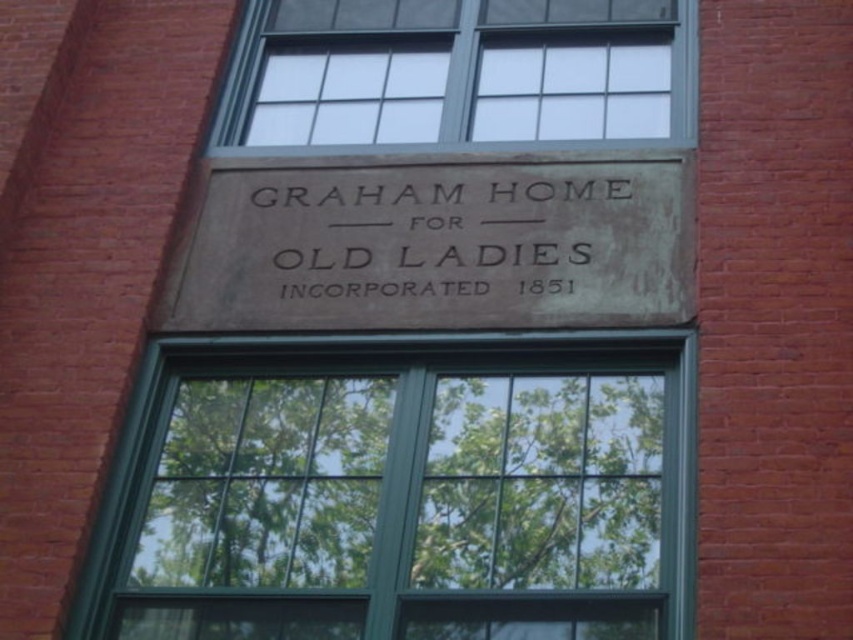
Question: Which of the following is the farthest from the observer?

Choices:
 (A) (387, 96)
 (B) (494, 548)
 (C) (541, 214)

Answer: (A)

Question: Does green glass window at center have a larger size compared to dark gray stone sign at center?

Choices:
 (A) yes
 (B) no

Answer: (A)

Question: Does green glass window at center appear on the left side of clear glass window at upper center?

Choices:
 (A) yes
 (B) no

Answer: (A)

Question: Is green glass window at center thinner than clear glass window at upper center?

Choices:
 (A) no
 (B) yes

Answer: (B)

Question: Among these objects, which one is nearest to the camera?

Choices:
 (A) clear glass window at upper center
 (B) green glass window at center

Answer: (B)

Question: Considering the real-world distances, which object is farthest from the clear glass window at upper center?

Choices:
 (A) dark gray stone sign at center
 (B) green glass window at center

Answer: (B)